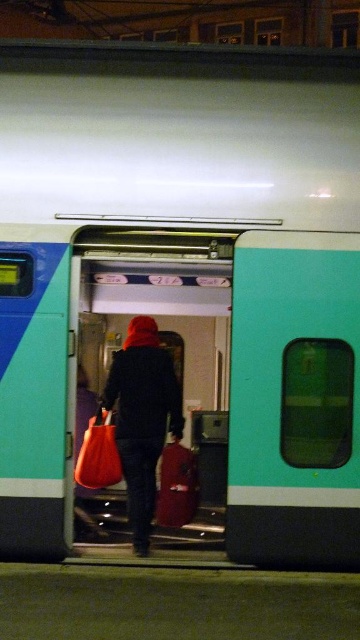
Question: Does dark blue fabric coat at center lie in front of matte orange bag at center?

Choices:
 (A) yes
 (B) no

Answer: (A)

Question: Is the position of dark blue fabric coat at center more distant than that of matte orange bag at center?

Choices:
 (A) no
 (B) yes

Answer: (A)

Question: Is dark blue fabric coat at center smaller than matte orange bag at center?

Choices:
 (A) no
 (B) yes

Answer: (A)

Question: Which of the following is the closest to the observer?

Choices:
 (A) dark blue fabric coat at center
 (B) matte orange bag at center

Answer: (A)

Question: Which point is farther to the camera?

Choices:
 (A) (75, 465)
 (B) (155, 458)

Answer: (A)

Question: Which object appears farthest from the camera in this image?

Choices:
 (A) matte orange bag at center
 (B) dark blue fabric coat at center

Answer: (A)